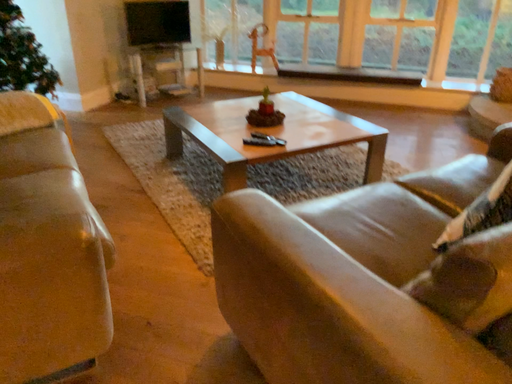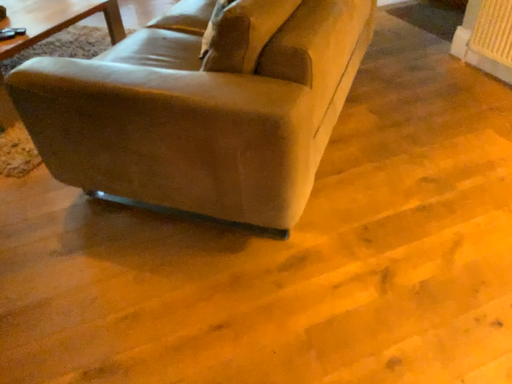
Question: Which way did the camera rotate in the video?

Choices:
 (A) rotated left
 (B) rotated right

Answer: (B)